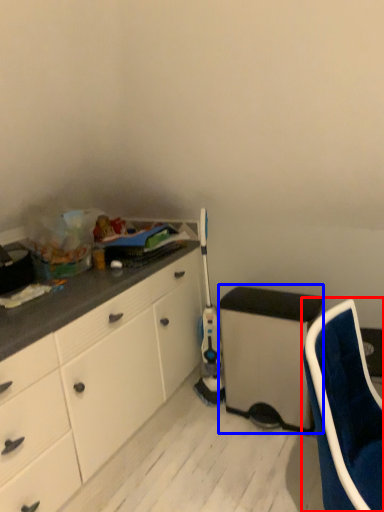
Question: Which point is closer to the camera, chair (highlighted by a red box) or appliance (highlighted by a blue box)?

Choices:
 (A) chair
 (B) appliance

Answer: (A)